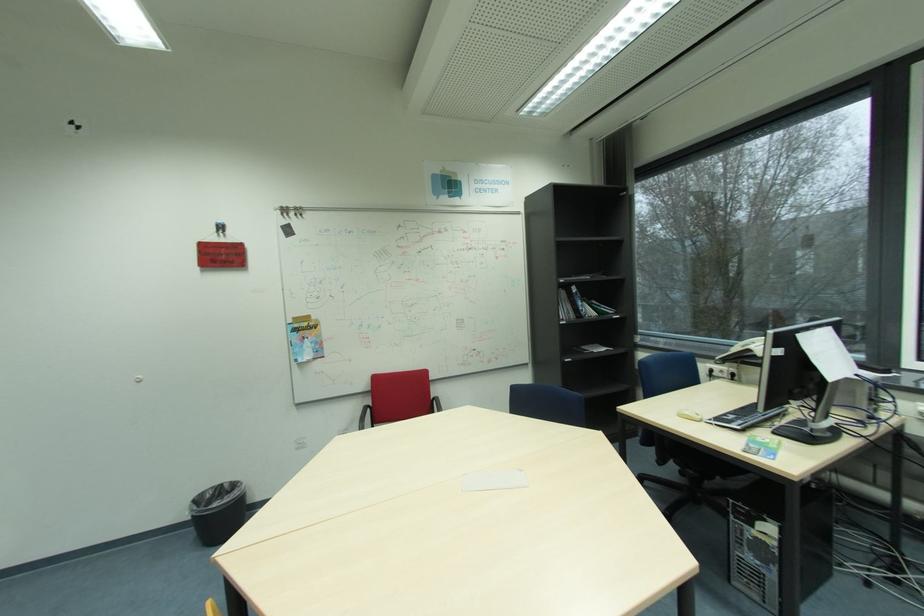
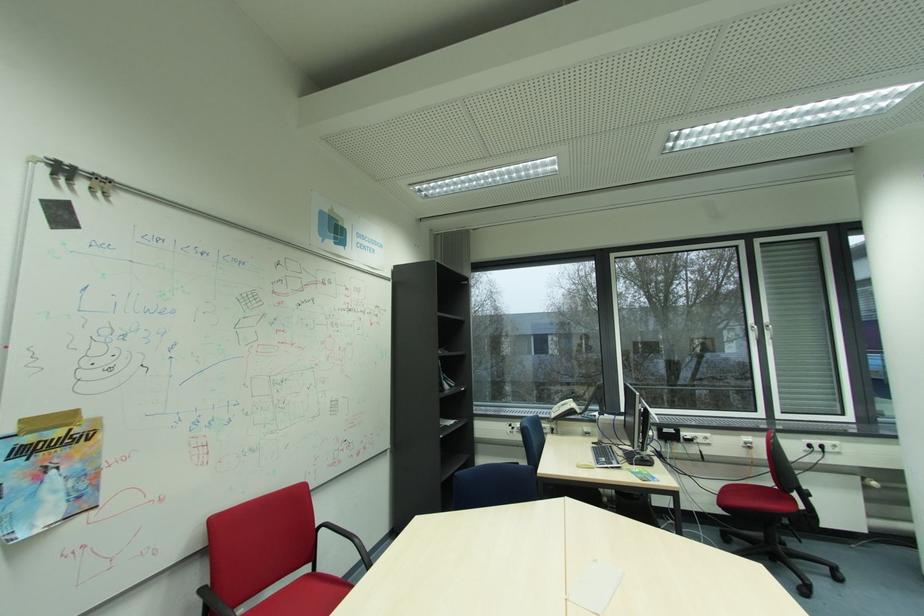
Find the pixel in the second image that matches [377,407] in the first image.

(212, 589)